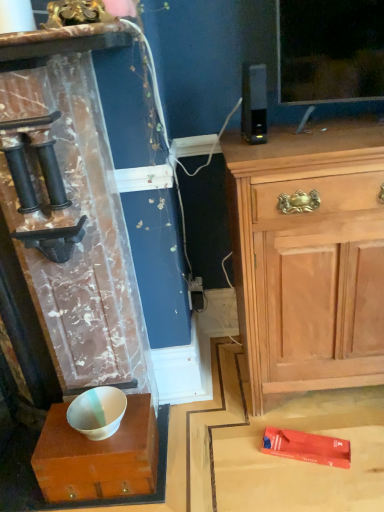
Question: Is white glossy bowl at center located outside light wood cabinet at upper right?

Choices:
 (A) no
 (B) yes

Answer: (B)

Question: From a real-world perspective, is white glossy bowl at center physically above light wood cabinet at upper right?

Choices:
 (A) no
 (B) yes

Answer: (A)

Question: Can you confirm if white glossy bowl at center is taller than light wood cabinet at upper right?

Choices:
 (A) no
 (B) yes

Answer: (A)

Question: Is white glossy bowl at center far from light wood cabinet at upper right?

Choices:
 (A) yes
 (B) no

Answer: (B)

Question: Can you confirm if white glossy bowl at center is positioned to the right of light wood cabinet at upper right?

Choices:
 (A) no
 (B) yes

Answer: (A)

Question: Looking at the image, does white glossy bowl at center seem bigger or smaller compared to light wood cabinet at upper right?

Choices:
 (A) small
 (B) big

Answer: (A)

Question: From a real-world perspective, is white glossy bowl at center above or below light wood cabinet at upper right?

Choices:
 (A) below
 (B) above

Answer: (A)

Question: Considering the positions of white glossy bowl at center and light wood cabinet at upper right in the image, is white glossy bowl at center wider or thinner than light wood cabinet at upper right?

Choices:
 (A) wide
 (B) thin

Answer: (B)

Question: From the image's perspective, is white glossy bowl at center located above or below light wood cabinet at upper right?

Choices:
 (A) below
 (B) above

Answer: (A)

Question: In terms of height, does white glossy bowl at center look taller or shorter compared to white glossy bowl at lower left?

Choices:
 (A) tall
 (B) short

Answer: (A)

Question: Relative to white glossy bowl at lower left, is white glossy bowl at center in front or behind?

Choices:
 (A) front
 (B) behind

Answer: (A)

Question: In terms of width, does white glossy bowl at center look wider or thinner when compared to white glossy bowl at lower left?

Choices:
 (A) thin
 (B) wide

Answer: (B)

Question: From the image's perspective, is white glossy bowl at center above or below white glossy bowl at lower left?

Choices:
 (A) below
 (B) above

Answer: (A)

Question: From a real-world perspective, is light wood cabinet at upper right positioned above or below white glossy bowl at center?

Choices:
 (A) above
 (B) below

Answer: (A)

Question: Considering the positions of point click(x=271, y=278) and point click(x=57, y=435), is point click(x=271, y=278) closer or farther from the camera than point click(x=57, y=435)?

Choices:
 (A) farther
 (B) closer

Answer: (B)